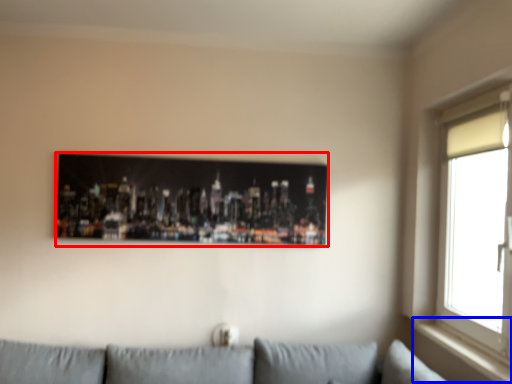
Question: Among these objects, which one is nearest to the camera, picture frame (highlighted by a red box) or window sill (highlighted by a blue box)?

Choices:
 (A) picture frame
 (B) window sill

Answer: (B)